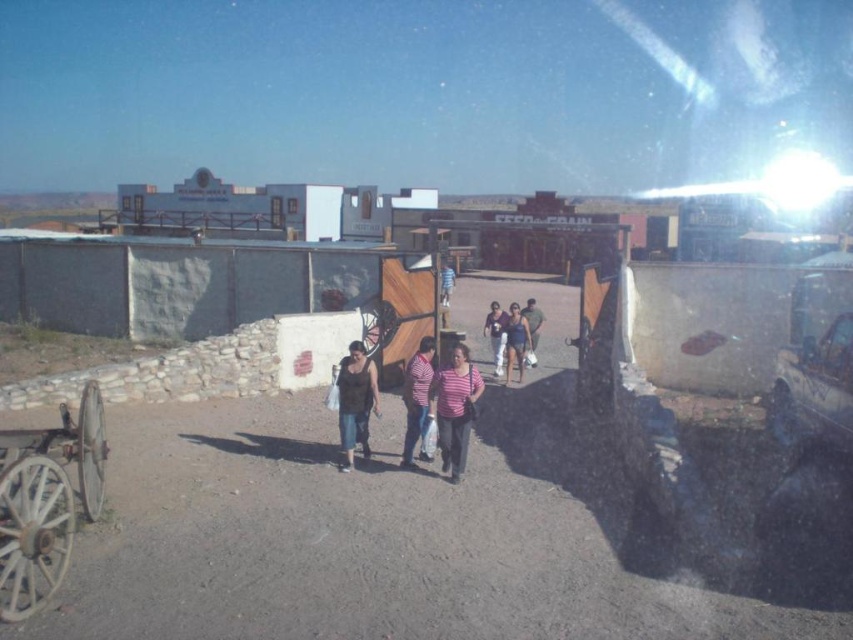
Is rusty metal wagon at lower left shorter than matte blue tank top at center?

No.

What do you see at coordinates (45, 500) in the screenshot? I see `rusty metal wagon at lower left` at bounding box center [45, 500].

At what (x,y) coordinates should I click in order to perform the action: click on rusty metal wagon at lower left. Please return your answer as a coordinate pair (x, y). Looking at the image, I should click on (45, 500).

Is striped cotton shirt at center bigger than striped fabric shirt at center?

Correct, striped cotton shirt at center is larger in size than striped fabric shirt at center.

Between point (428, 392) and point (409, 371), which one is positioned in front?

Positioned in front is point (428, 392).

Locate an element on the screen. The width and height of the screenshot is (853, 640). striped cotton shirt at center is located at coordinates pyautogui.click(x=454, y=408).

Is point (410, 358) behind point (543, 317)?

No, (410, 358) is in front of (543, 317).

Between striped fabric shirt at center and green fabric shirt at center, which one has more height?

striped fabric shirt at center

Describe the element at coordinates (416, 396) in the screenshot. I see `striped fabric shirt at center` at that location.

Locate an element on the screen. This screenshot has width=853, height=640. striped fabric shirt at center is located at coordinates (416, 396).